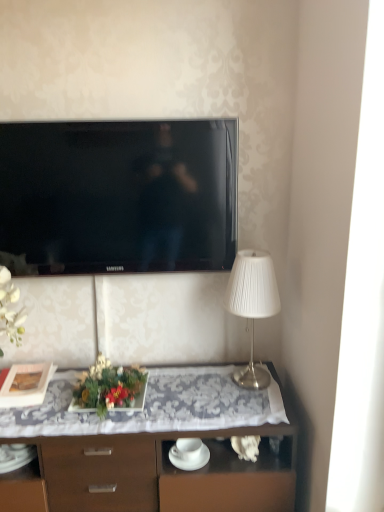
Where is `vacant point to the right of green leafy plant at center`? This screenshot has width=384, height=512. vacant point to the right of green leafy plant at center is located at coordinates (180, 398).